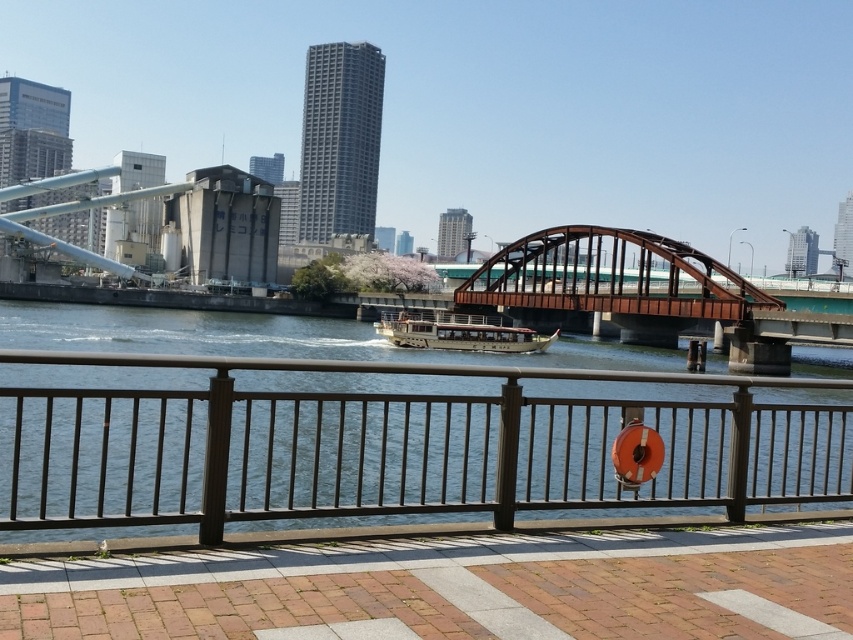
You are a photographer planning to take a photo of the brown metallic bridge at center and the wooden polished boat at center from the walkway. Given their sizes, which object should you focus on to ensure both are clearly visible in the frame without one overwhelming the other?

The brown metallic bridge at center is larger than the wooden polished boat at center, so to ensure both are clearly visible without one overwhelming the other, focus on the bridge as the primary subject while positioning the boat in the foreground or background to balance the composition.